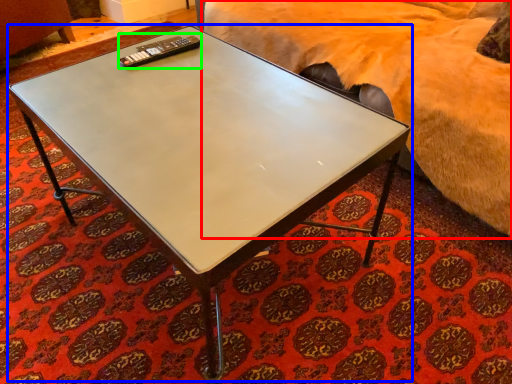
Question: Which object is positioned farthest from bed (highlighted by a red box)? Select from coffee table (highlighted by a blue box) and remote (highlighted by a green box).

Choices:
 (A) coffee table
 (B) remote

Answer: (B)